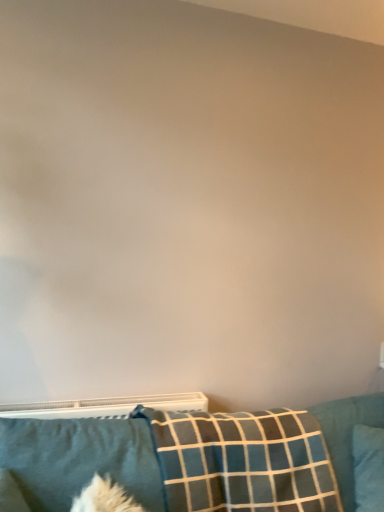
Question: Is teal fabric couch at lower center surrounded by soft blue fabric pillow at lower left, which ranks as the first pillow in left-to-right order?

Choices:
 (A) no
 (B) yes

Answer: (A)

Question: From the image's perspective, is soft blue fabric pillow at lower left, acting as the 3th pillow starting from the right, over teal fabric couch at lower center?

Choices:
 (A) no
 (B) yes

Answer: (B)

Question: Can you confirm if soft blue fabric pillow at lower left, acting as the 3th pillow starting from the right, is wider than teal fabric couch at lower center?

Choices:
 (A) yes
 (B) no

Answer: (B)

Question: Can you confirm if soft blue fabric pillow at lower left, acting as the 3th pillow starting from the right, is thinner than teal fabric couch at lower center?

Choices:
 (A) no
 (B) yes

Answer: (B)

Question: Is soft blue fabric pillow at lower left, which ranks as the first pillow in left-to-right order, smaller than teal fabric couch at lower center?

Choices:
 (A) yes
 (B) no

Answer: (A)

Question: Considering the positions of blue fabric pillow at lower right, which is counted as the first pillow, starting from the right, and plaid fabric pillow at lower center, the second pillow positioned from the left, in the image, is blue fabric pillow at lower right, which is counted as the first pillow, starting from the right, wider or thinner than plaid fabric pillow at lower center, the second pillow positioned from the left,?

Choices:
 (A) wide
 (B) thin

Answer: (B)

Question: Is blue fabric pillow at lower right, which is counted as the first pillow, starting from the right, in front of or behind plaid fabric pillow at lower center, the second pillow positioned from the left, in the image?

Choices:
 (A) front
 (B) behind

Answer: (B)

Question: From the image's perspective, is blue fabric pillow at lower right, which is counted as the first pillow, starting from the right, located above or below plaid fabric pillow at lower center, acting as the second pillow starting from the right?

Choices:
 (A) above
 (B) below

Answer: (B)

Question: Choose the correct answer: Is blue fabric pillow at lower right, which is counted as the first pillow, starting from the right, inside plaid fabric pillow at lower center, acting as the second pillow starting from the right, or outside it?

Choices:
 (A) inside
 (B) outside

Answer: (B)

Question: Relative to blue fabric pillow at lower right, which appears as the third pillow when viewed from the left, is plaid fabric pillow at lower center, the second pillow positioned from the left, in front or behind?

Choices:
 (A) behind
 (B) front

Answer: (B)

Question: Does point (235, 481) appear closer or farther from the camera than point (355, 494)?

Choices:
 (A) farther
 (B) closer

Answer: (B)

Question: From a real-world perspective, is plaid fabric pillow at lower center, acting as the second pillow starting from the right, positioned above or below blue fabric pillow at lower right, which appears as the third pillow when viewed from the left?

Choices:
 (A) below
 (B) above

Answer: (B)

Question: In terms of height, does plaid fabric pillow at lower center, the second pillow positioned from the left, look taller or shorter compared to blue fabric pillow at lower right, which is counted as the first pillow, starting from the right?

Choices:
 (A) short
 (B) tall

Answer: (B)

Question: Which is correct: blue fabric pillow at lower right, which is counted as the first pillow, starting from the right, is inside soft blue fabric pillow at lower left, acting as the 3th pillow starting from the right, or outside of it?

Choices:
 (A) inside
 (B) outside

Answer: (B)

Question: From a real-world perspective, is blue fabric pillow at lower right, which appears as the third pillow when viewed from the left, positioned above or below soft blue fabric pillow at lower left, acting as the 3th pillow starting from the right?

Choices:
 (A) below
 (B) above

Answer: (A)